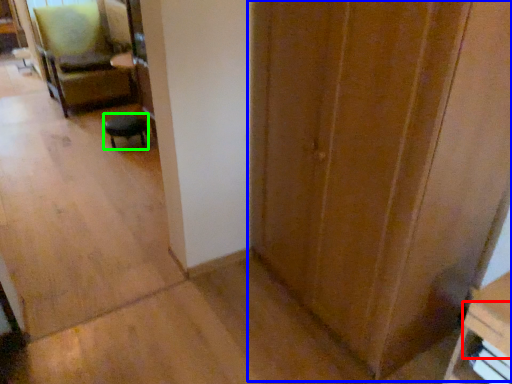
Question: Based on their relative distances, which object is nearer to drawer (highlighted by a red box)? Choose from door (highlighted by a blue box) and furniture (highlighted by a green box).

Choices:
 (A) door
 (B) furniture

Answer: (A)